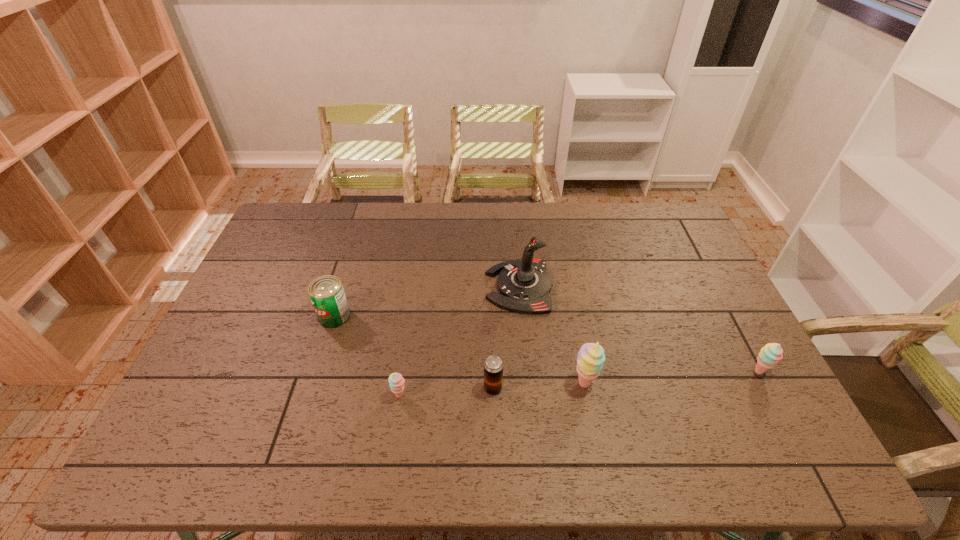
All sherberts are currently evenly spaced. To continue this pattern, where would you add another sherbert on the left? Please point out a vacant spot. Please provide its 2D coordinates. Your answer should be formatted as a tuple, i.e. [(x, y)], where the tuple contains the x and y coordinates of a point satisfying the conditions above.

[(208, 408)]